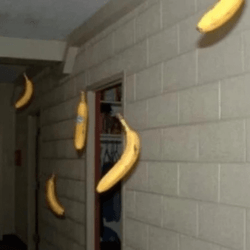
I want to click on clothes hanging on hangers, so click(x=105, y=211), click(x=113, y=204).